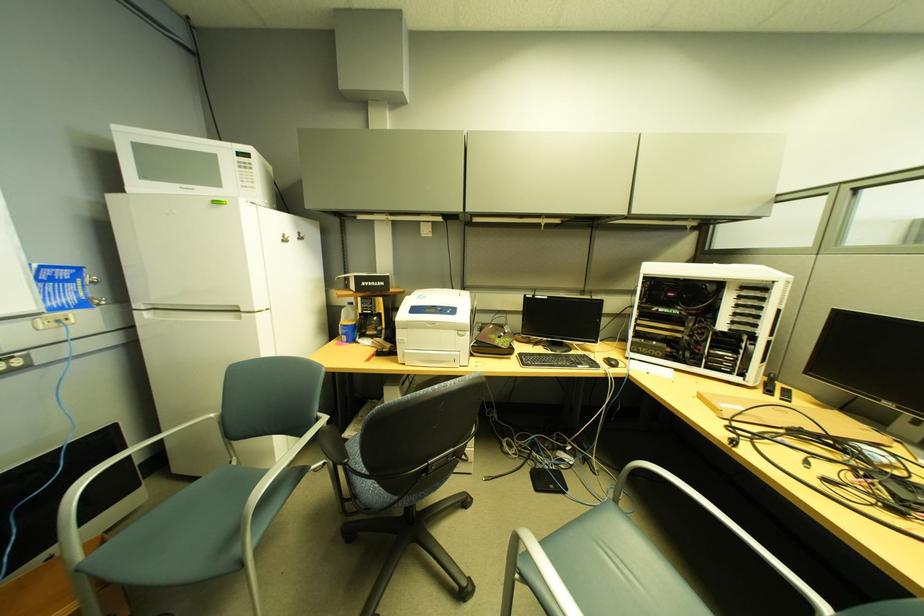
Locate an element on the screen. black computer mouse is located at coordinates (611, 362).